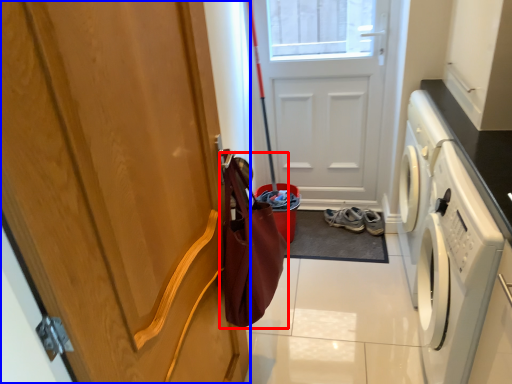
Question: Which of the following is the closest to the observer, shopping bag (highlighted by a red box) or door (highlighted by a blue box)?

Choices:
 (A) shopping bag
 (B) door

Answer: (B)